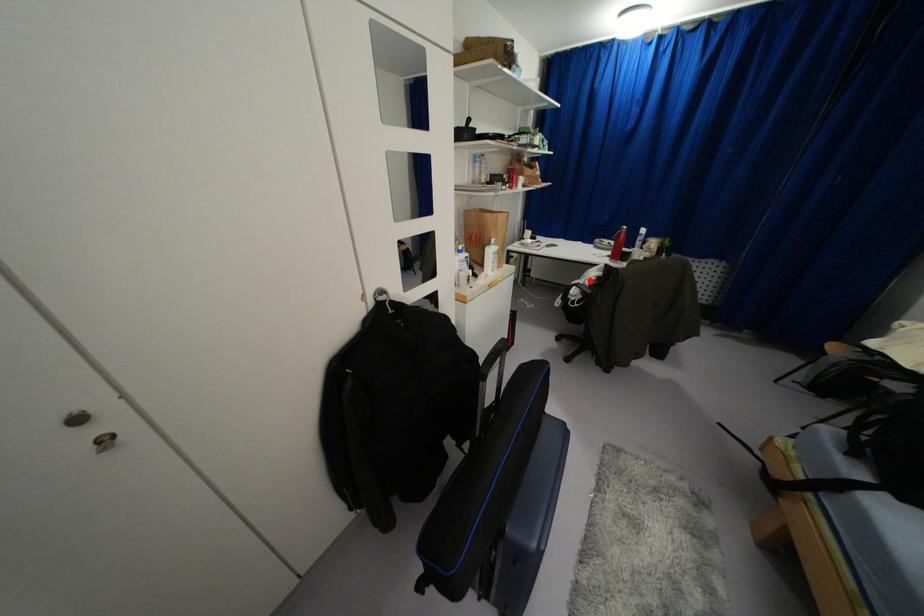
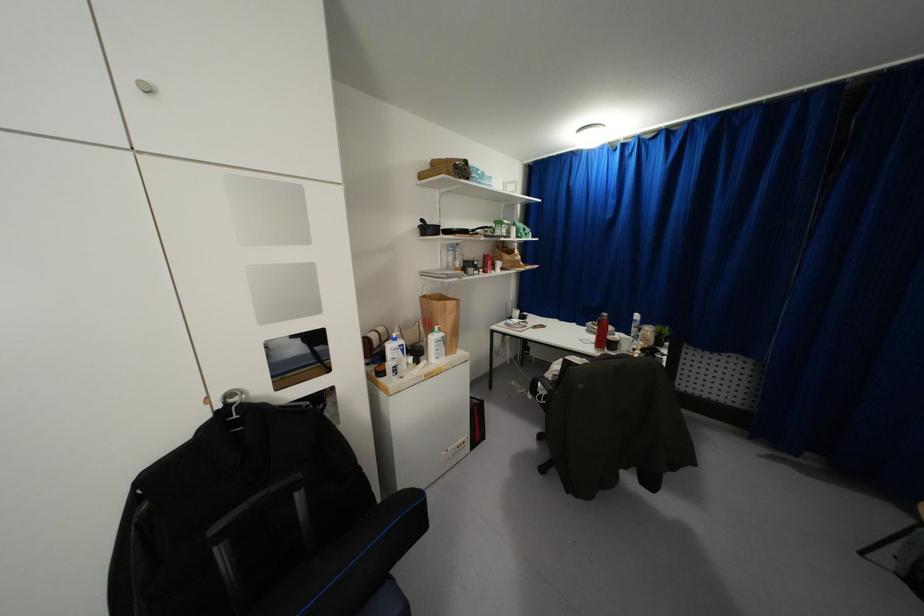
Question: I am providing you with two images of the same scene from different viewpoints. Image1 has a red point marked. In image2, the corresponding 3D location appears at what relative position? Reply with the corresponding letter.

Choices:
 (A) Closer
 (B) Farther

Answer: (A)